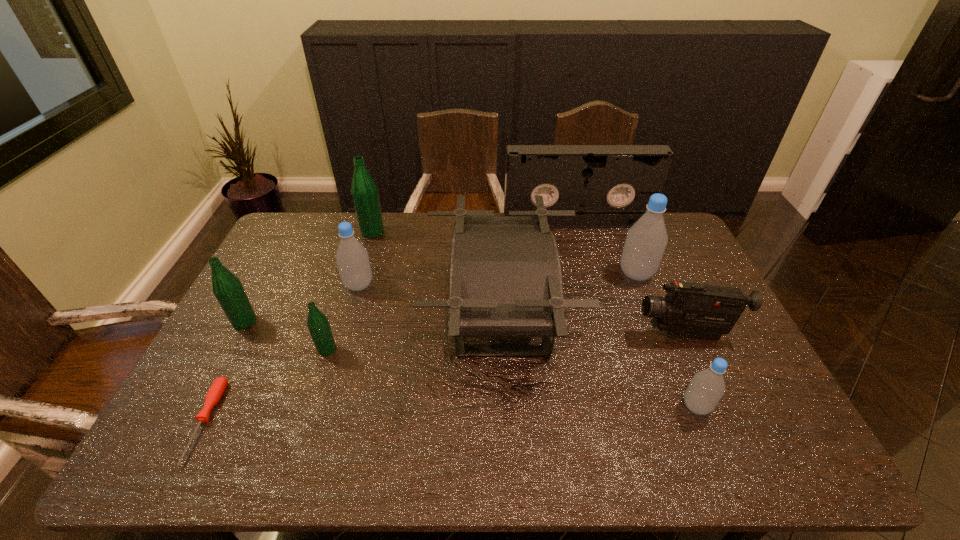
This screenshot has height=540, width=960. I want to click on vacant area located 0.190m on the left of the leftmost gray bottle, so click(285, 285).

Identify the location of vacant space situated 0.210m on the back of the leftmost bottle. (274, 268).

Identify the location of free space located on the front-facing side of the black camcorder. Image resolution: width=960 pixels, height=540 pixels. (532, 334).

The height and width of the screenshot is (540, 960). I want to click on vacant area located 0.110m on the front-facing side of the black camcorder, so click(x=598, y=334).

Where is `vacant region located on the front-facing side of the black camcorder`? The height and width of the screenshot is (540, 960). vacant region located on the front-facing side of the black camcorder is located at coordinates (511, 334).

This screenshot has height=540, width=960. I want to click on vacant area situated 0.290m on the right of the fifth farthest bottle, so click(x=441, y=349).

Image resolution: width=960 pixels, height=540 pixels. I want to click on free location located on the right of the nearest gray bottle, so click(751, 406).

The height and width of the screenshot is (540, 960). I want to click on videotape present at the far edge, so [608, 186].

The width and height of the screenshot is (960, 540). I want to click on bottle located at the far edge, so click(x=364, y=191).

Where is `object located in the near edge section of the desktop`? The height and width of the screenshot is (540, 960). object located in the near edge section of the desktop is located at coordinates (218, 387).